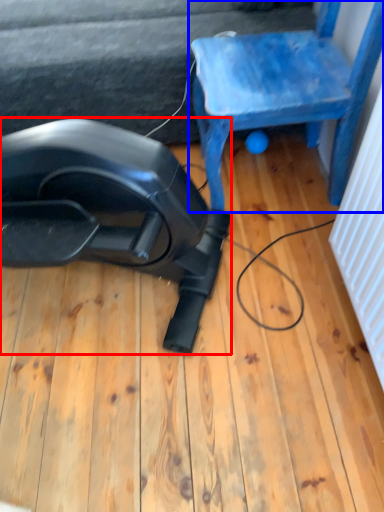
Question: Which point is further to the camera, equipment (highlighted by a red box) or chair (highlighted by a blue box)?

Choices:
 (A) equipment
 (B) chair

Answer: (B)